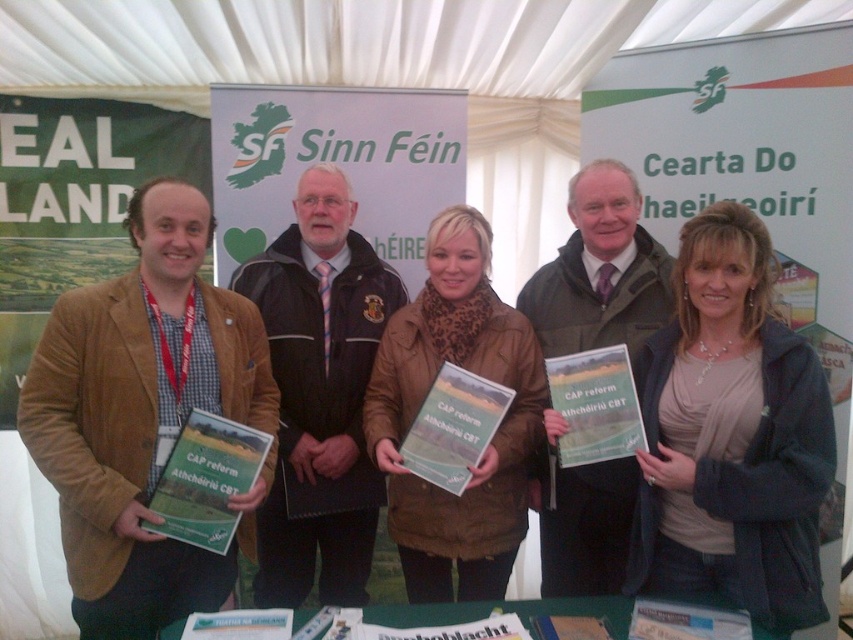
You are organizing a booth at an event and need to set up a green fabric table at center. Where should you place it in relation to the matte black jacket at center?

The green fabric table at center should be placed behind the matte black jacket at center according to the description.

You are at a political rally and need to hand out pamphlets. There are two people wearing jackets in brown colors. The first is wearing a brown suede jacket at left and the second is wearing a brown textured jacket at center. Which jacket is positioned more to the left side?

The brown suede jacket at left is positioned more to the left side than the brown textured jacket at center.

You are organizing a photo shoot and need to position a 1.5m tall tripod between the matte black jacket at center and the green fabric table at center. Can the tripod be placed there without blocking the view of the jacket?

The matte black jacket at center is taller than the green fabric table at center. Since the tripod is 1.5m tall, placing it between them might block the view of the jacket if the jacket is taller than the tripod. However, the description only states the jacket is taller than the table, not the tripod. Without knowing the exact height of the jacket, it is uncertain if the tripod will block it.